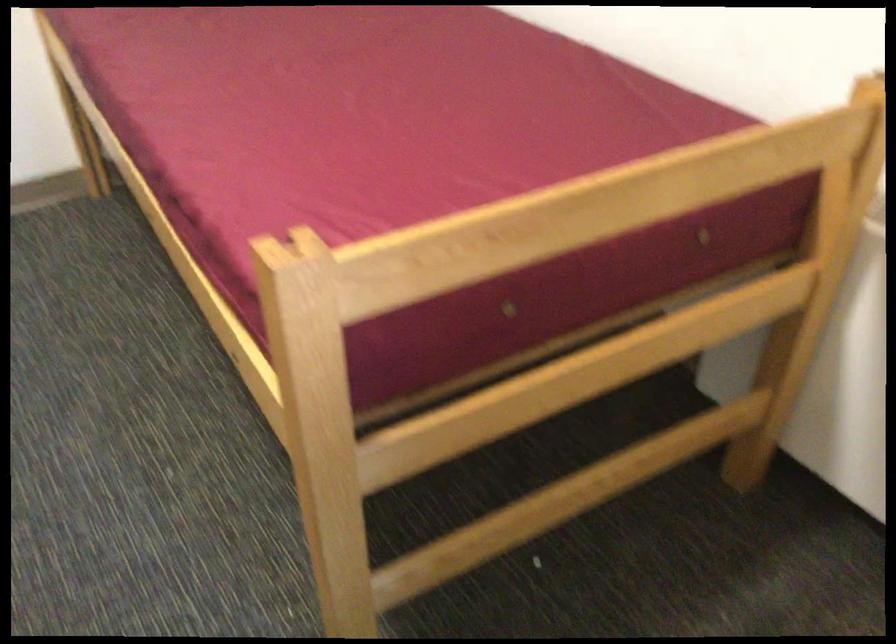
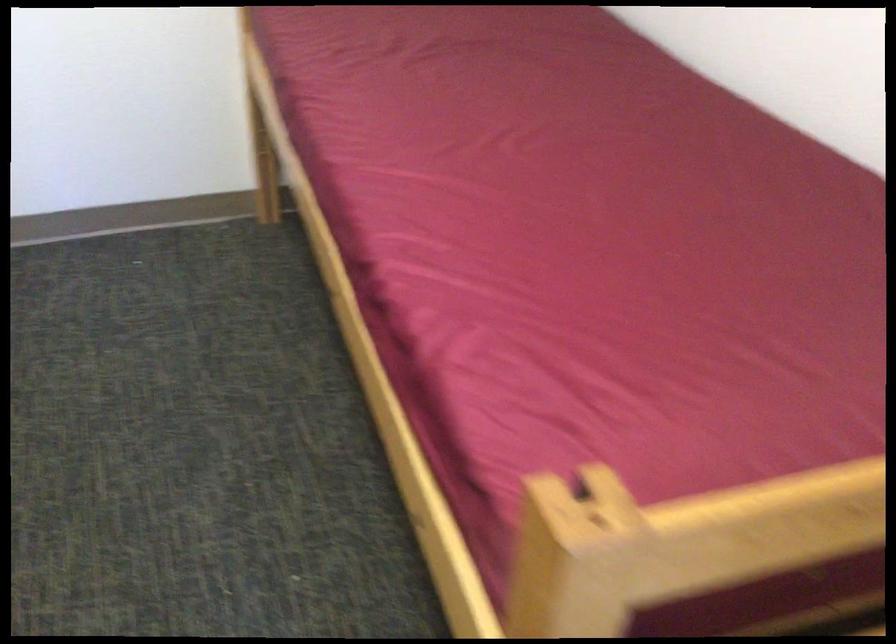
In the second image, find the point that corresponds to point 364,256 in the first image.

(684, 536)